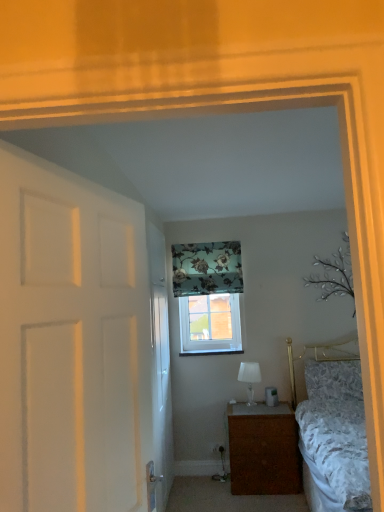
Identify the location of vacant space in floral fabric curtain at upper center (from a real-world perspective). (200, 470).